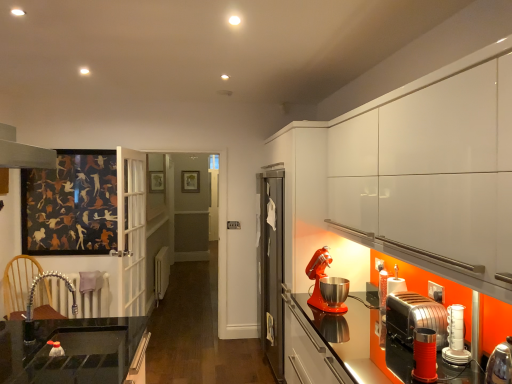
Question: Is wooden picture frame at center spatially inside white glossy toaster at lower right, the 3th kitchen appliance when ordered from back to front, or outside of it?

Choices:
 (A) outside
 (B) inside

Answer: (A)

Question: From a real-world perspective, is wooden picture frame at center positioned above or below white glossy toaster at lower right, the 3th kitchen appliance when ordered from back to front?

Choices:
 (A) below
 (B) above

Answer: (B)

Question: Considering the real-world distances, which object is farthest from the polished chrome toaster at lower right, the second kitchen appliance from the back?

Choices:
 (A) metallic red stand mixer at right, the fourth kitchen appliance from the front
 (B) wooden picture frame at center
 (C) white glossy toaster at lower right, the second kitchen appliance when ordered from front to back
 (D) metallic red toaster at lower right, positioned as the 1th kitchen appliance in front-to-back order

Answer: (B)

Question: Which object is the closest to the polished chrome toaster at lower right, the second kitchen appliance from the back?

Choices:
 (A) metallic red stand mixer at right, placed as the first kitchen appliance when sorted from back to front
 (B) metallic red toaster at lower right, positioned as the 1th kitchen appliance in front-to-back order
 (C) white glossy toaster at lower right, the 3th kitchen appliance when ordered from back to front
 (D) wooden picture frame at center

Answer: (B)